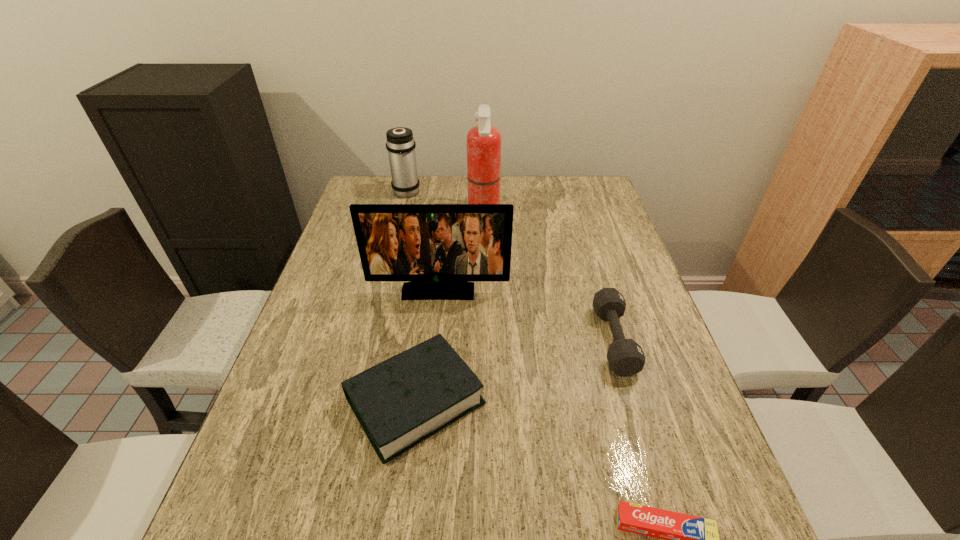
I want to click on fire extinguisher, so click(483, 141).

Locate an element on the screen. the third farthest object is located at coordinates (438, 247).

The width and height of the screenshot is (960, 540). Identify the location of the fifth shortest object. (438, 247).

Locate an element on the screen. thermos bottle is located at coordinates (400, 144).

Find the location of a particular element. This screenshot has width=960, height=540. dumbbell is located at coordinates (625, 357).

In order to click on Bible in this screenshot , I will do `click(402, 401)`.

Identify the location of free spot located 0.260m with the handle and hose on the tallest object. This screenshot has width=960, height=540. (389, 213).

The height and width of the screenshot is (540, 960). Identify the location of vacant space located with the handle and hose on the tallest object. [372, 213].

At what (x,y) coordinates should I click in order to perform the action: click on vacant space located 0.230m with the handle and hose on the tallest object. Please return your answer as a coordinate pair (x, y). Looking at the image, I should click on (398, 213).

Identify the location of free spot located 0.160m on the front-facing side of the second tallest object. The width and height of the screenshot is (960, 540). (433, 348).